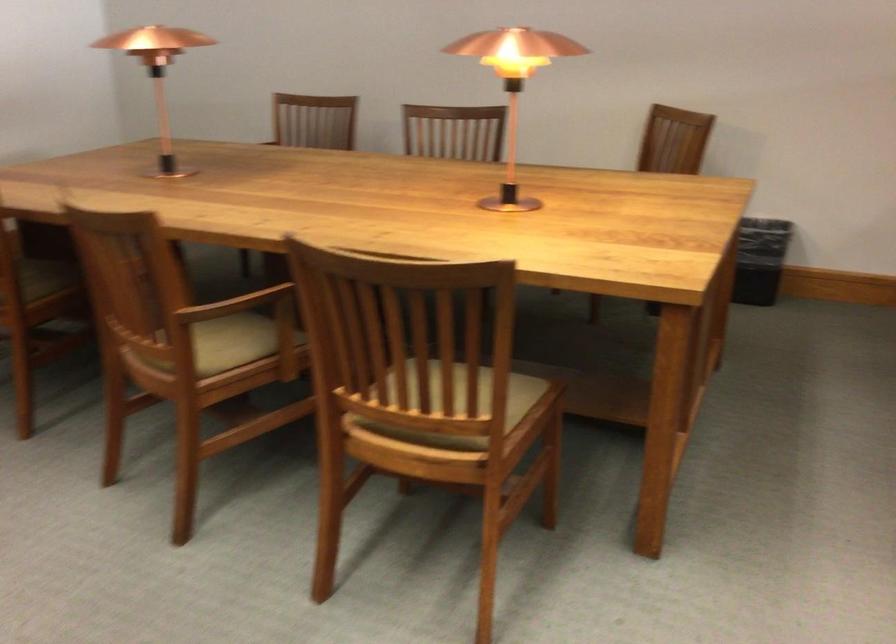
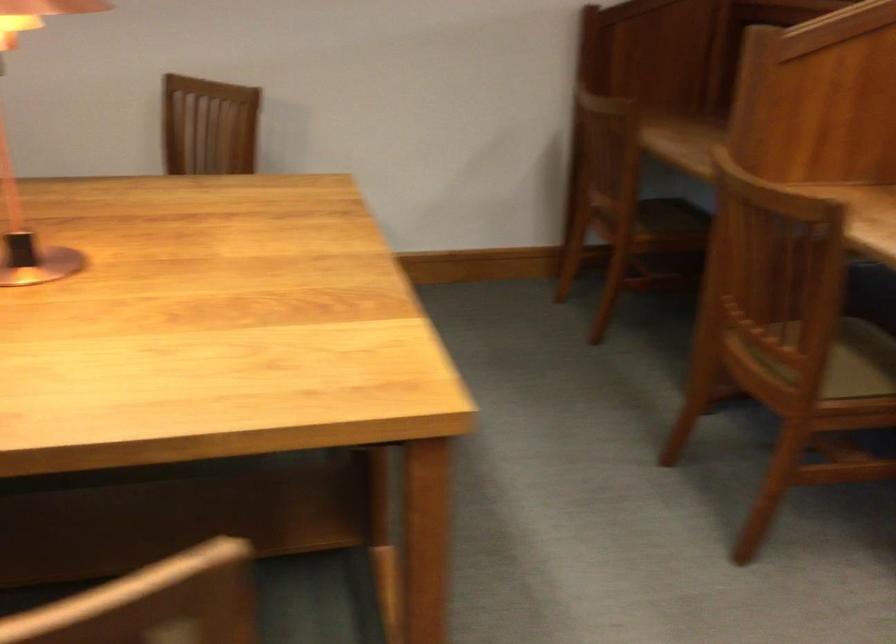
Question: How did the camera likely rotate?

Choices:
 (A) Left
 (B) Right
 (C) Up
 (D) Down

Answer: (B)